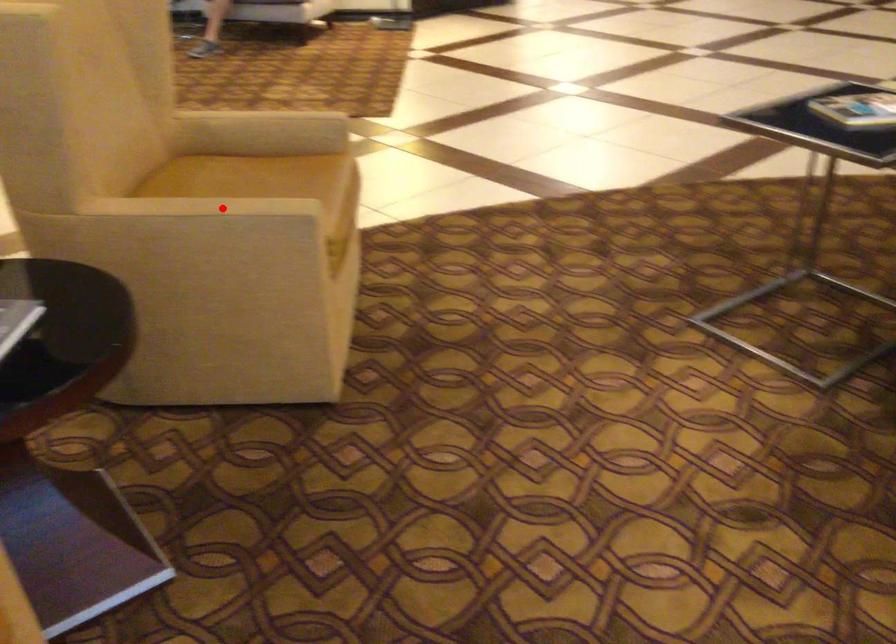
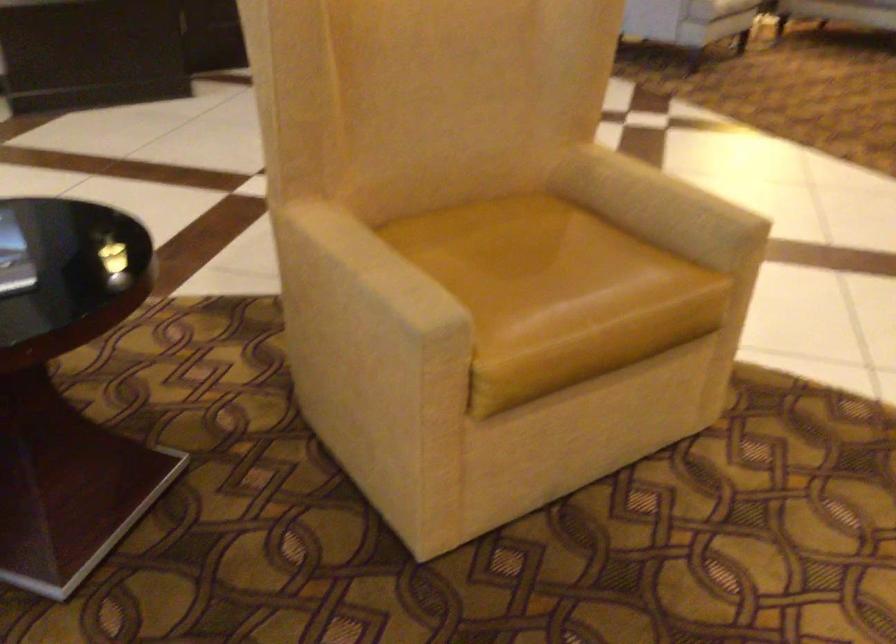
Question: I am providing you with two images of the same scene from different viewpoints. Image1 has a red point marked. In image2, the corresponding 3D location appears at what relative position? Reply with the corresponding letter.

Choices:
 (A) Closer
 (B) Farther

Answer: (A)